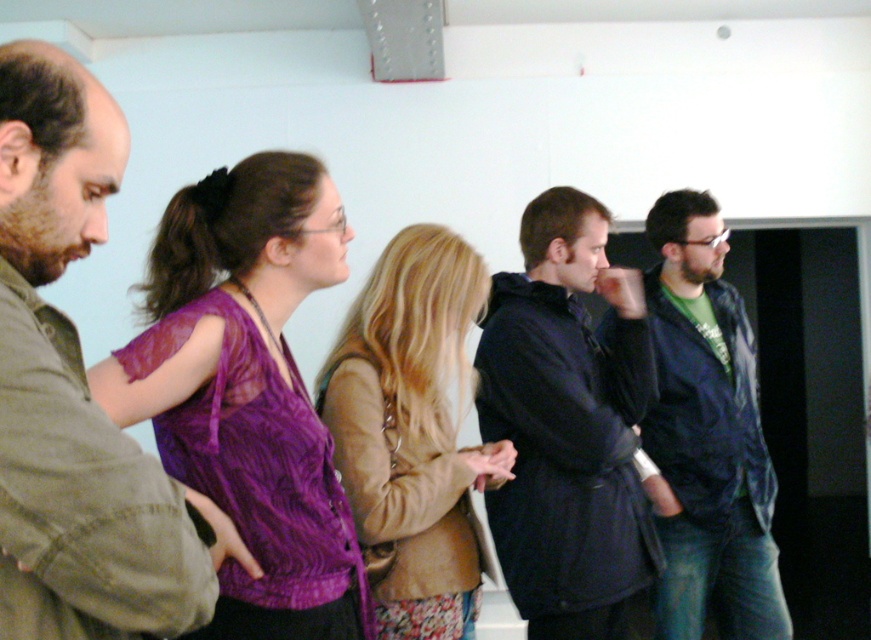
Question: Which of the following is the closest to the observer?

Choices:
 (A) dark blue coat at center
 (B) matte purple blouse at center
 (C) matte green shirt at left
 (D) dark blue jacket at right

Answer: (C)

Question: Does matte green shirt at left have a smaller size compared to purple sheer blouse at center?

Choices:
 (A) yes
 (B) no

Answer: (A)

Question: Among these points, which one is farthest from the camera?

Choices:
 (A) (80, 486)
 (B) (673, 257)

Answer: (B)

Question: Can you confirm if matte green shirt at left is positioned to the left of dark blue jacket at right?

Choices:
 (A) yes
 (B) no

Answer: (A)

Question: Among these objects, which one is farthest from the camera?

Choices:
 (A) matte purple blouse at center
 (B) dark blue coat at center
 (C) matte green shirt at left
 (D) dark blue jacket at right

Answer: (D)

Question: Does matte purple blouse at center appear over dark blue jacket at right?

Choices:
 (A) no
 (B) yes

Answer: (B)